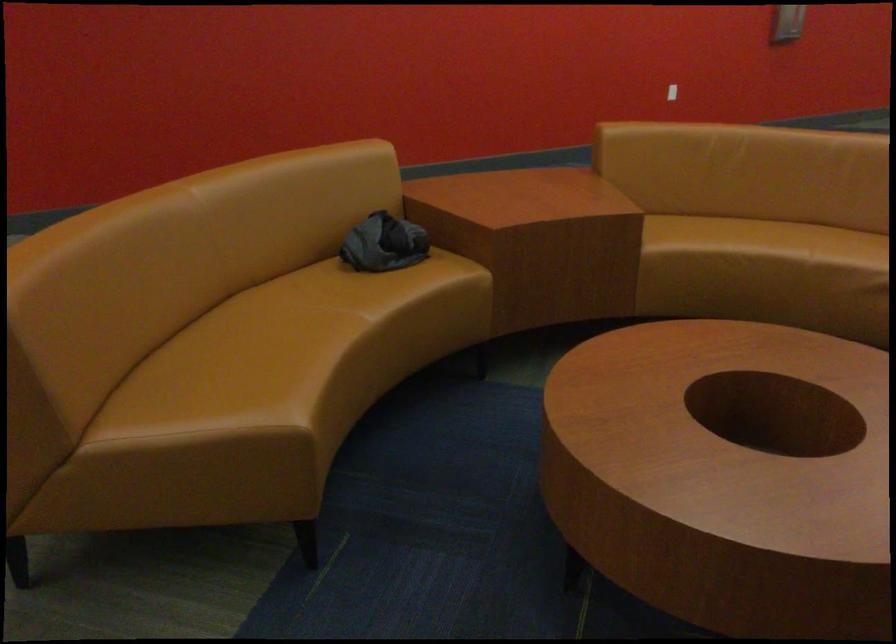
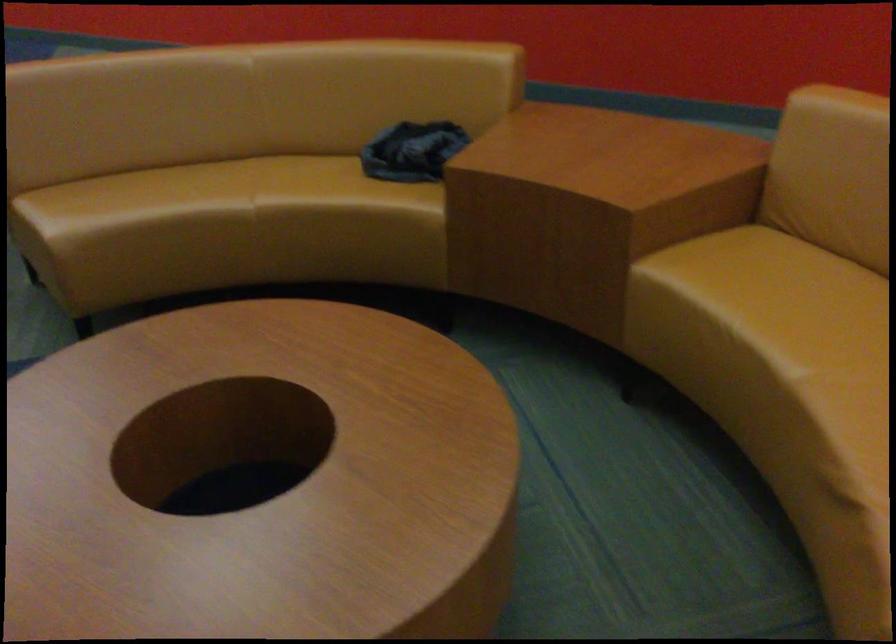
Find the pixel in the second image that matches the point at 375,335 in the first image.

(255, 220)